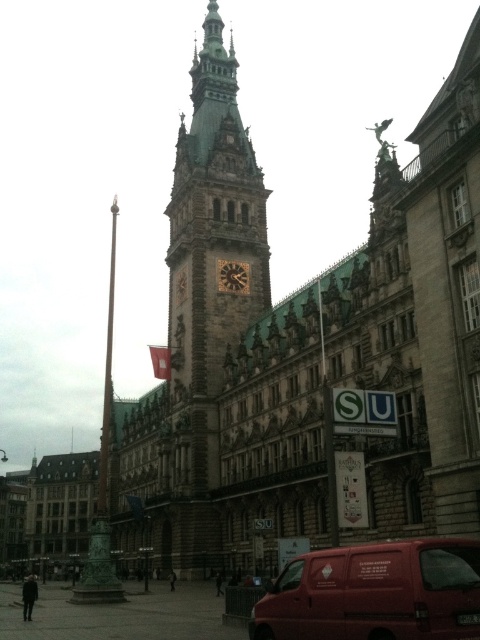
You are standing in front of the historic Rathaus building. You see a gold textured clock at center and a silky red flag at center. Which object is positioned to the right when viewed from your perspective?

The gold textured clock at center is to the right of the silky red flag at center.

You are a tourist standing in front of the historic building and want to take a photo that includes both the gold textured clock at center and the silky red flag at center. Which object should you focus on first to ensure both are in frame?

The gold textured clock at center has a lesser height compared to the silky red flag at center, so you should focus on the silky red flag at center first to ensure both are in frame.